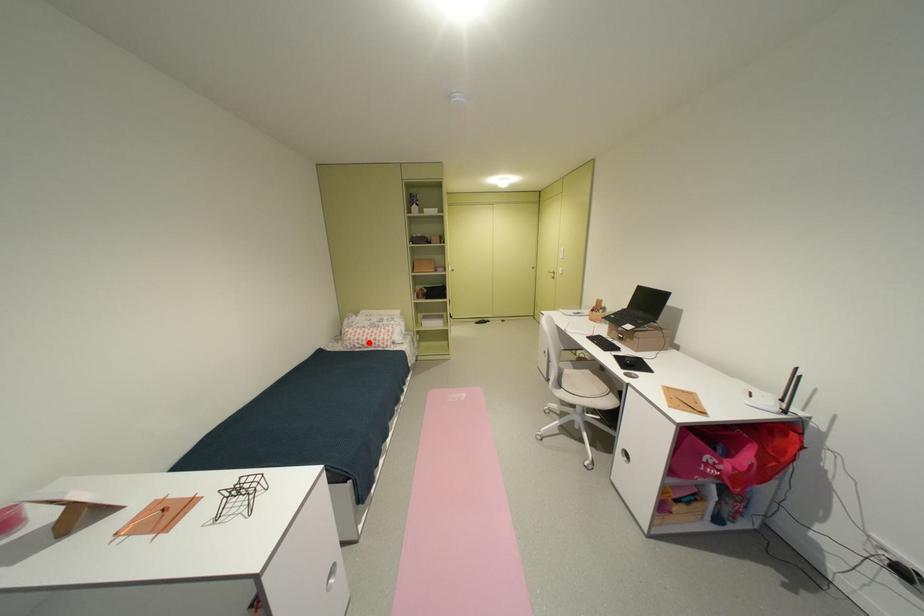
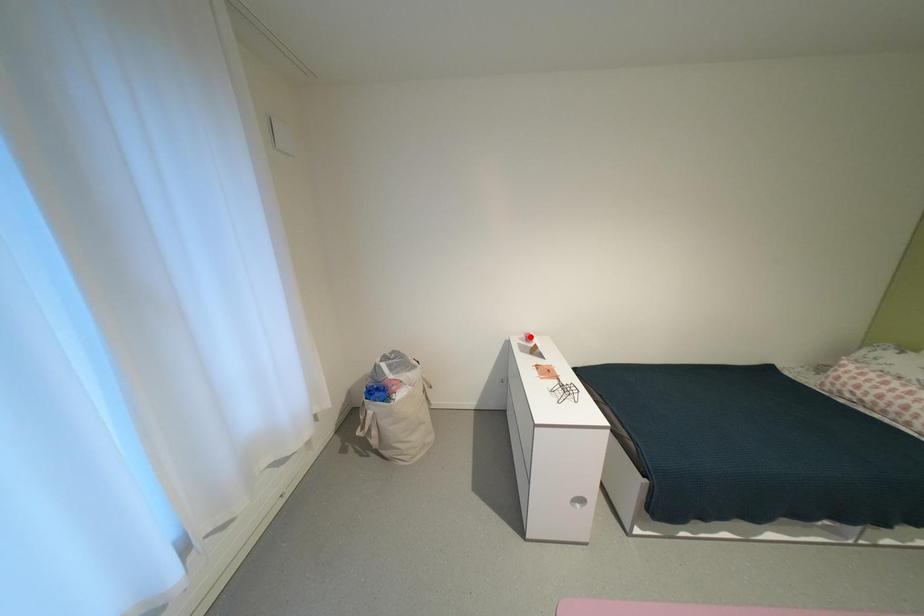
I am providing you with two images of the same scene from different viewpoints. A red point is marked on the first image and another point is marked on the second image. Are the points marked in image1 and image2 representing the same 3D position?

No